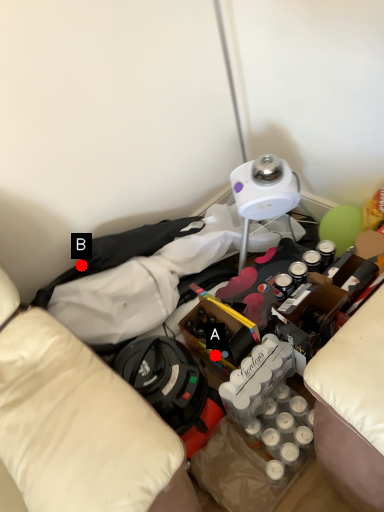
Question: Two points are circled on the image, labeled by A and B beside each circle. Which point is closer to the camera taking this photo?

Choices:
 (A) A is closer
 (B) B is closer

Answer: (A)